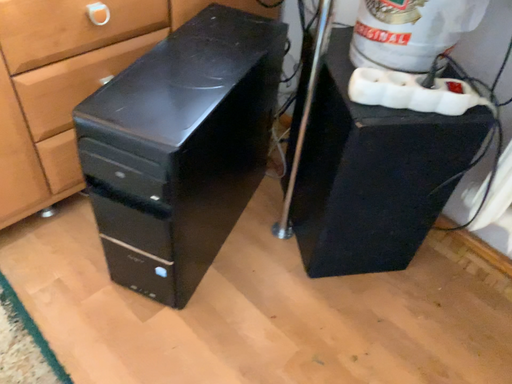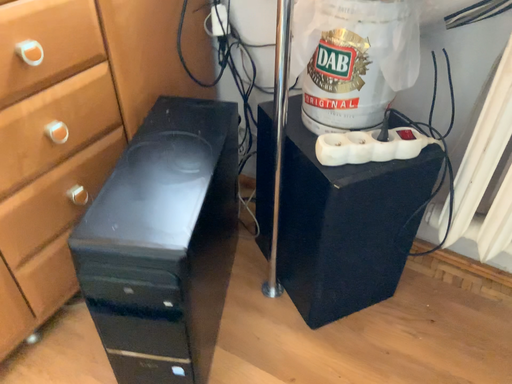
Question: Which way did the camera rotate in the video?

Choices:
 (A) rotated right
 (B) rotated left

Answer: (A)